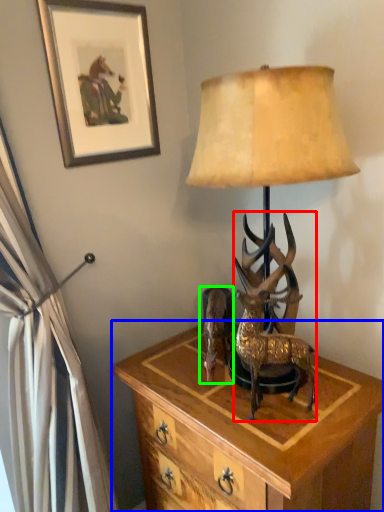
Question: Which object is the closest to the deer (highlighted by a red box)? Choose among these: nightstand (highlighted by a blue box) or reindeer (highlighted by a green box).

Choices:
 (A) nightstand
 (B) reindeer

Answer: (B)